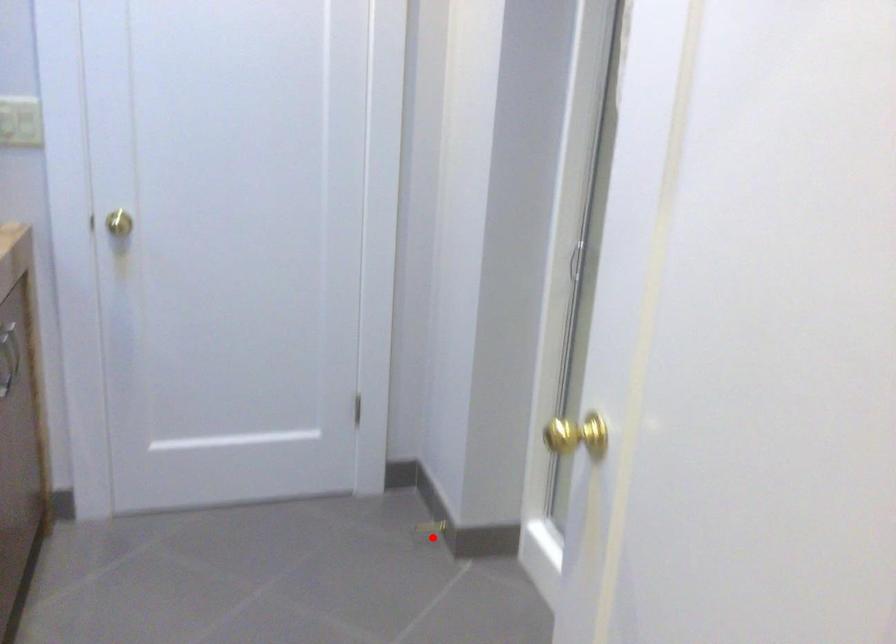
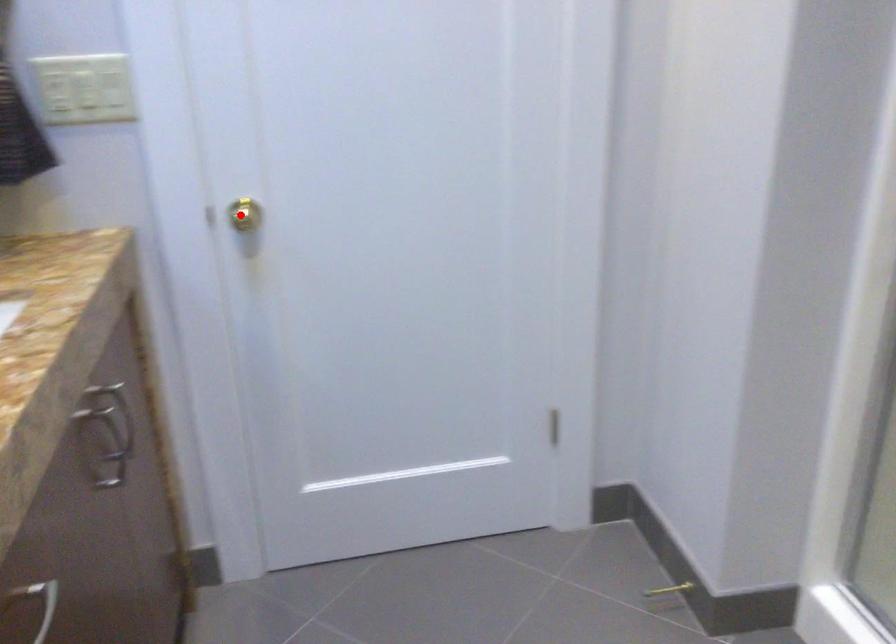
I am providing you with two images of the same scene from different viewpoints. A red point is marked on the first image and another point is marked on the second image. Is the red point in image1 aligned with the point shown in image2?

No